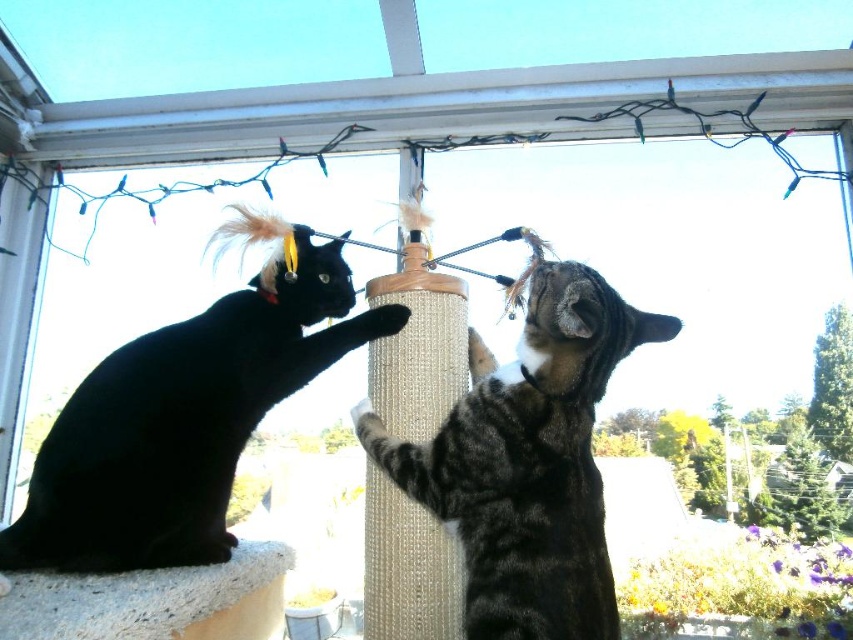
Which is in front, point (355, 316) or point (456, 419)?

Positioned in front is point (456, 419).

Is shiny black cat at left below tabby fur cat at center?

No.

The image size is (853, 640). I want to click on shiny black cat at left, so click(183, 420).

Can you confirm if shiny black cat at left is wider than white textured window sill at lower left?

Yes, shiny black cat at left is wider than white textured window sill at lower left.

Who is more distant from viewer, (137, 342) or (178, 595)?

The point (137, 342) is more distant.

Image resolution: width=853 pixels, height=640 pixels. Describe the element at coordinates (183, 420) in the screenshot. I see `shiny black cat at left` at that location.

You are a GUI agent. You are given a task and a screenshot of the screen. Output one action in this format:
    pyautogui.click(x=<x>, y=<y>)
    Task: Click on the shiny black cat at left
    This screenshot has width=853, height=640.
    Given the screenshot: What is the action you would take?
    pyautogui.click(x=183, y=420)

Is point (592, 458) farther from viewer compared to point (15, 593)?

Yes, it is behind point (15, 593).

Is tabby fur cat at center to the right of white textured window sill at lower left from the viewer's perspective?

Indeed, tabby fur cat at center is positioned on the right side of white textured window sill at lower left.

Is point (583, 573) farther from viewer compared to point (186, 624)?

No, it is in front of (186, 624).

Where is `tabby fur cat at center`? The width and height of the screenshot is (853, 640). tabby fur cat at center is located at coordinates (x=527, y=461).